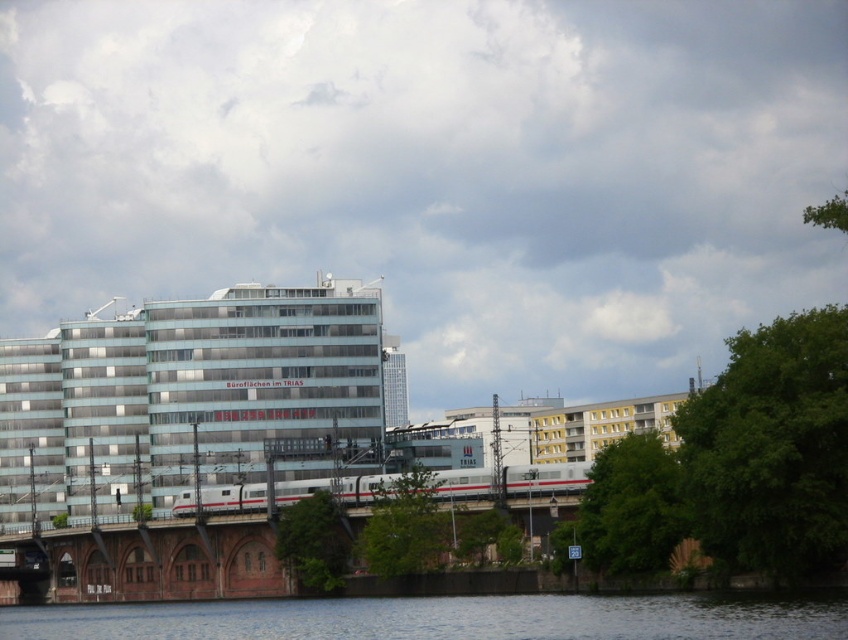
Question: Which of the following is the closest to the observer?

Choices:
 (A) (322, 602)
 (B) (188, 513)

Answer: (A)

Question: Which object is positioned farthest from the light blue glass building at center?

Choices:
 (A) silver metallic train at center
 (B) transparent water at lower center

Answer: (B)

Question: Does light blue glass building at center have a greater width compared to transparent water at lower center?

Choices:
 (A) no
 (B) yes

Answer: (A)

Question: Which object is closer to the camera taking this photo?

Choices:
 (A) transparent water at lower center
 (B) light blue glass building at center
 (C) silver metallic train at center

Answer: (A)

Question: Where is light blue glass building at center located in relation to transparent water at lower center in the image?

Choices:
 (A) below
 (B) above

Answer: (B)

Question: Can you confirm if light blue glass building at center is bigger than transparent water at lower center?

Choices:
 (A) yes
 (B) no

Answer: (A)